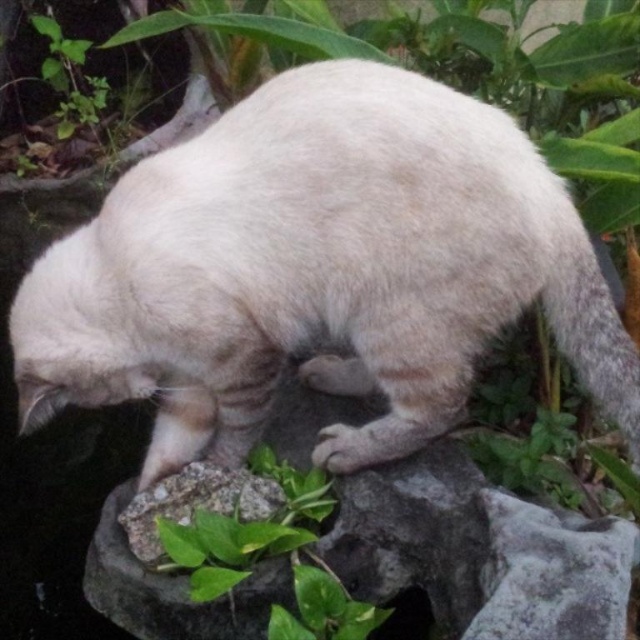
Question: Does white fur cat at center have a larger size compared to green leafy plant at center?

Choices:
 (A) no
 (B) yes

Answer: (B)

Question: Does white fur cat at center appear under green leafy plant at center?

Choices:
 (A) yes
 (B) no

Answer: (B)

Question: Is white fur cat at center to the left of green leafy plant at center from the viewer's perspective?

Choices:
 (A) yes
 (B) no

Answer: (B)

Question: Among these objects, which one is farthest from the camera?

Choices:
 (A) white fur cat at center
 (B) green leafy plant at center

Answer: (A)

Question: Which of the following is the closest to the observer?

Choices:
 (A) white fur cat at center
 (B) green leafy plant at center

Answer: (B)

Question: Which object appears closest to the camera in this image?

Choices:
 (A) white fur cat at center
 (B) green leafy plant at center

Answer: (B)